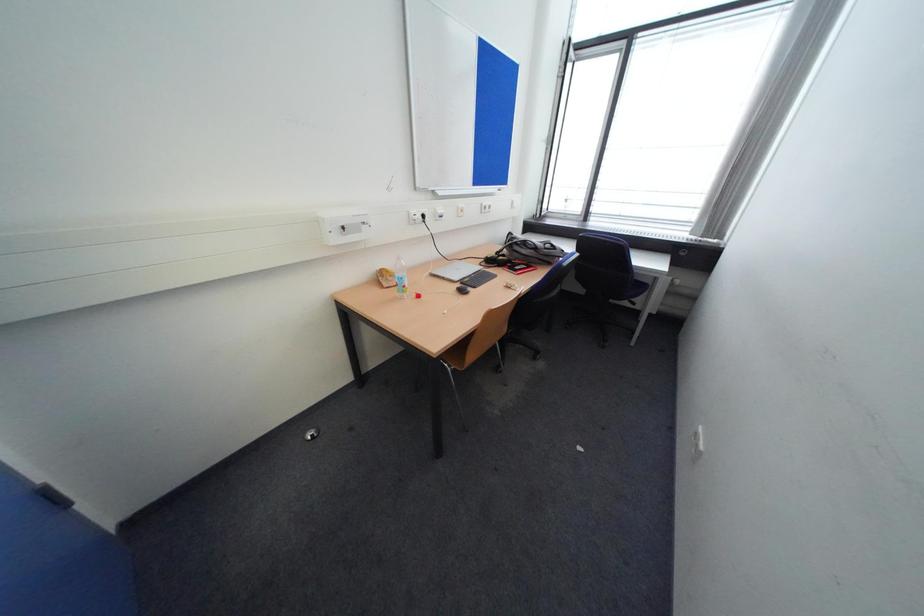
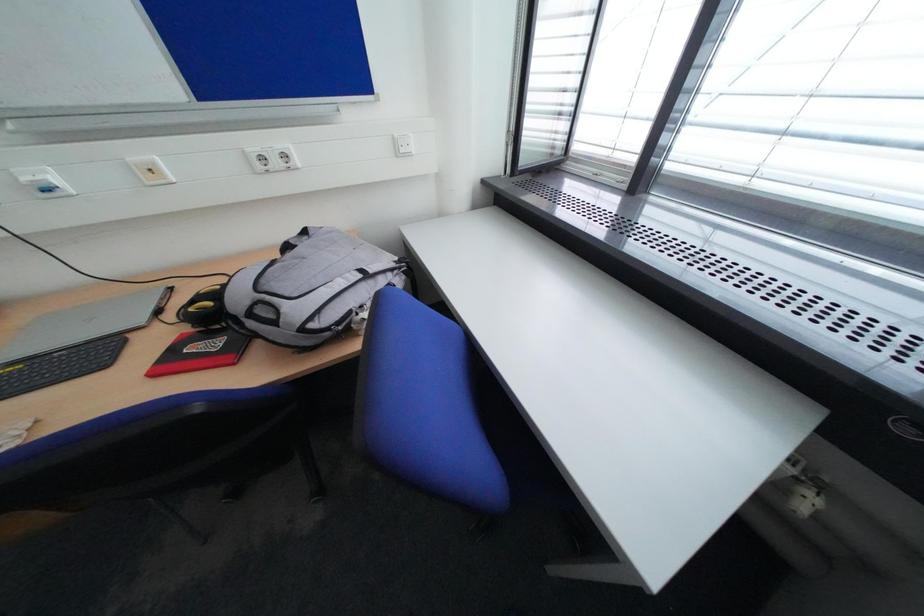
What movement of the cameraman would produce the second image?

The movement direction of the cameraman is right, forward.